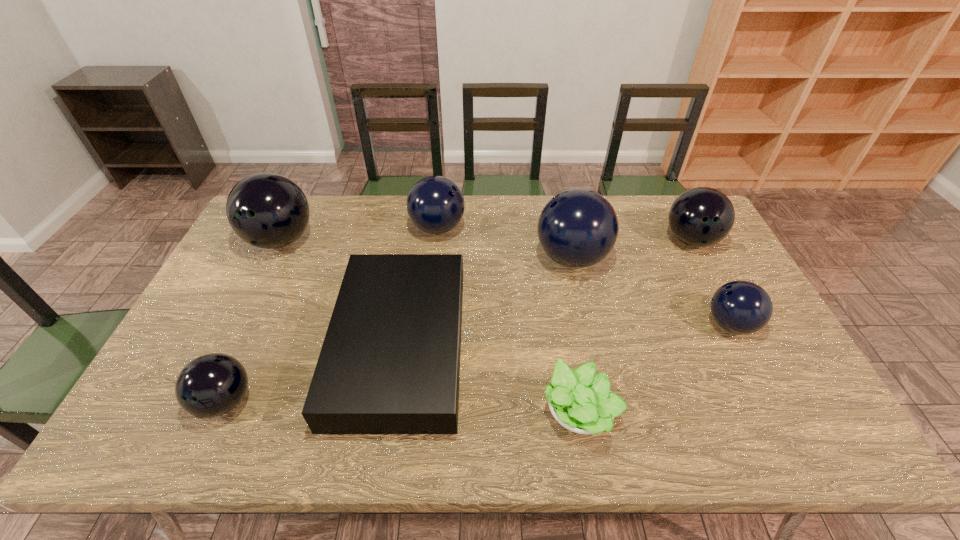
The image size is (960, 540). Find the location of `free space at the near edge of the desktop`. free space at the near edge of the desktop is located at coordinates click(317, 438).

In order to click on blank space at the left edge of the desktop in this screenshot , I will do `click(260, 257)`.

This screenshot has width=960, height=540. Identify the location of free region at the right edge of the desktop. (707, 259).

Find the location of a particular element. free space at the far right corner of the desktop is located at coordinates (670, 198).

Where is `free space that is in between the green lettuce and the second smallest black bowling ball`? The height and width of the screenshot is (540, 960). free space that is in between the green lettuce and the second smallest black bowling ball is located at coordinates (635, 326).

Where is `vacant area that lies between the fourth bowling ball from left to right and the rightmost black bowling ball`? The image size is (960, 540). vacant area that lies between the fourth bowling ball from left to right and the rightmost black bowling ball is located at coordinates (632, 249).

This screenshot has height=540, width=960. Identify the location of free space between the CD player and the nearest blue bowling ball. (565, 335).

Find the location of a particular element. empty space that is in between the smallest blue bowling ball and the biggest black bowling ball is located at coordinates (506, 282).

This screenshot has width=960, height=540. What are the coordinates of `empty space that is in between the biggest blue bowling ball and the green lettuce` in the screenshot? It's located at (575, 335).

The image size is (960, 540). I want to click on vacant area that lies between the second smallest black bowling ball and the CD player, so click(545, 293).